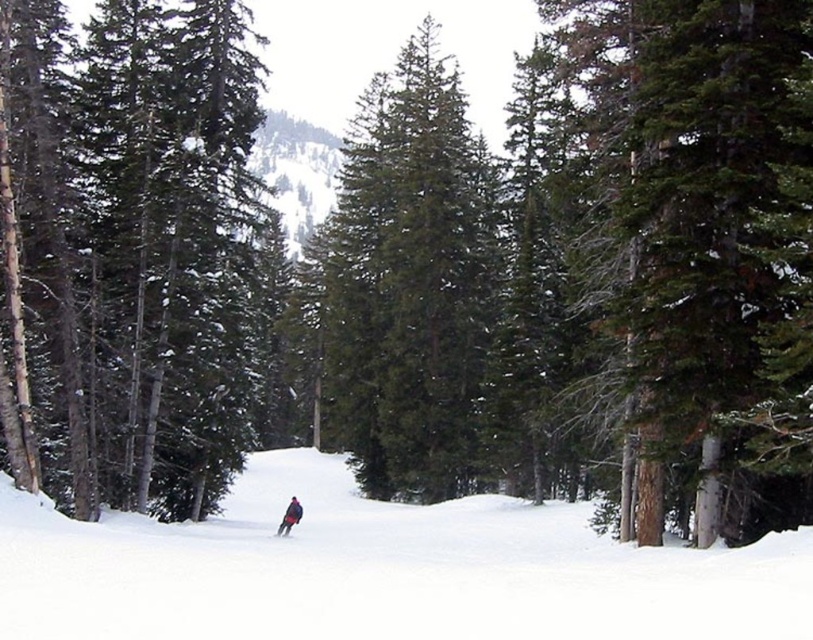
Consider the image. You are a drone operator trying to capture a photo of the skier in the winter forest scene. The camera is positioned at a certain height. There is a specific point in the image labeled as point (174,51). If the distance from the camera to this point is 37.34 meters, can the drone safely descend to 30 meters altitude to get a better shot without hitting any obstacles?

The distance between the camera and point (174,51) is 37.34 meters. Since the drone needs to descend to 30 meters, which is closer than the current distance, it would be unsafe as the drone might collide with obstacles like trees or the skier. Maintain the current altitude of 37.34 meters to avoid collisions.

You are a skier navigating through the forest. You see a green matte tree at center and a shiny black ski at center. Which object is positioned more to the right?

The shiny black ski at center is positioned more to the right than the green matte tree at center.

You are a skier navigating through the forest. You notice two trees ahead of you in the center of your view. One is labeled as a green matte tree at center and the other as a green evergreen tree at center. Which tree would you need to avoid if you want to stay on the narrower path between them?

The green evergreen tree at center is narrower than the green matte tree at center, so you should avoid the green matte tree at center to stay on the narrower path between them.